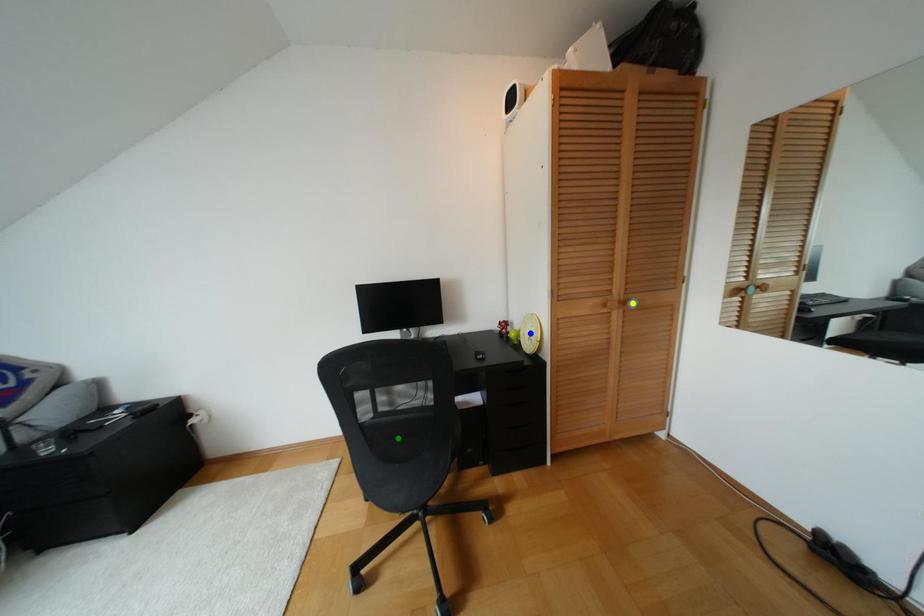
Order these from nearest to farthest:
- yellow point
- blue point
- green point

1. yellow point
2. green point
3. blue point